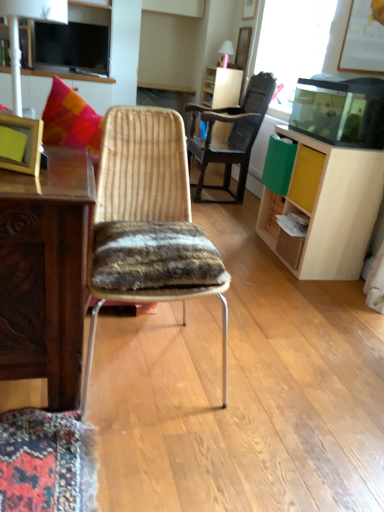
What is the approximate height of matte white lamp at upper left?

matte white lamp at upper left is 18.06 inches tall.

What do you see at coordinates (143, 166) in the screenshot? The image size is (384, 512). I see `woven wood chair at center, which is counted as the first chair, starting from the bottom` at bounding box center [143, 166].

I want to click on woven wood chair at center, arranged as the first chair when viewed from the top, so click(x=230, y=136).

Where is `light wood cabinet at right`? This screenshot has height=512, width=384. light wood cabinet at right is located at coordinates (333, 205).

Where is `matte white lamp at upper left`? The image size is (384, 512). matte white lamp at upper left is located at coordinates tap(18, 32).

Who is smaller, light wood cabinet at right or matte white lamp at upper left?

Smaller between the two is matte white lamp at upper left.

Is light wood cabinet at right positioned far away from matte white lamp at upper left?

That's right, there is a large distance between light wood cabinet at right and matte white lamp at upper left.

Identify the location of cabinetry that is below the matte white lamp at upper left (from the image's perspective). (333, 205).

Is matte white lamp at upper left surrounded by wooden picture frame at left?

No.

From a real-world perspective, which object rests below the other?

wooden picture frame at left is physically lower.

Is wooden picture frame at left positioned in front of matte white lamp at upper left?

No, wooden picture frame at left is further to the viewer.

Between wooden picture frame at left and matte white lamp at upper left, which one has larger width?

With larger width is matte white lamp at upper left.

Which is more to the left, matte white lamp at upper left or woven wood chair at center, positioned as the 2th chair in bottom-to-top order?

matte white lamp at upper left.

Is matte white lamp at upper left not inside woven wood chair at center, placed as the 2th chair when sorted from front to back?

Indeed, matte white lamp at upper left is completely outside woven wood chair at center, placed as the 2th chair when sorted from front to back.

In terms of width, does matte white lamp at upper left look wider or thinner when compared to woven wood chair at center, placed as the 2th chair when sorted from front to back?

Clearly, matte white lamp at upper left has less width compared to woven wood chair at center, placed as the 2th chair when sorted from front to back.

Find the location of a particular element. chair above the matte white lamp at upper left (from the image's perspective) is located at coordinates (230, 136).

Does woven wood chair at center, arranged as the first chair when viewed from the top, have a lesser width compared to woven wood chair at center, acting as the 1th chair starting from the front?

No, woven wood chair at center, arranged as the first chair when viewed from the top, is not thinner than woven wood chair at center, acting as the 1th chair starting from the front.

Is woven wood chair at center, arranged as the first chair when viewed from the top, in front of or behind woven wood chair at center, which is the second chair in back-to-front order, in the image?

In the image, woven wood chair at center, arranged as the first chair when viewed from the top, appears behind woven wood chair at center, which is the second chair in back-to-front order.

Is woven wood chair at center, acting as the 1th chair starting from the front, at the back of woven wood chair at center, which is counted as the 1th chair, starting from the back?

No, woven wood chair at center, which is counted as the 1th chair, starting from the back, is not facing away from woven wood chair at center, acting as the 1th chair starting from the front.

Considering the relative positions of woven wood chair at center, arranged as the first chair when viewed from the top, and woven wood chair at center, acting as the 1th chair starting from the front, in the image provided, is woven wood chair at center, arranged as the first chair when viewed from the top, to the right of woven wood chair at center, acting as the 1th chair starting from the front, from the viewer's perspective?

Indeed, woven wood chair at center, arranged as the first chair when viewed from the top, is positioned on the right side of woven wood chair at center, acting as the 1th chair starting from the front.

In the scene shown: Is light wood drawer at right to the right of wooden picture frame at left from the viewer's perspective?

Indeed, light wood drawer at right is positioned on the right side of wooden picture frame at left.

Consider the image. Is light wood drawer at right located outside wooden picture frame at left?

That's correct, light wood drawer at right is outside of wooden picture frame at left.

From the image's perspective, which is above, light wood drawer at right or wooden picture frame at left?

light wood drawer at right appears higher in the image.

Is light wood drawer at right turned away from wooden picture frame at left?

No, light wood drawer at right is not facing the opposite direction of wooden picture frame at left.

Consider the image. Which of these two, woven wood chair at center, which is the second chair in back-to-front order, or light wood cabinet at right, is thinner?

light wood cabinet at right.

You are a GUI agent. You are given a task and a screenshot of the screen. Output one action in this format:
    pyautogui.click(x=<x>, y=<y>)
    Task: Click on the cabinetry behind the woven wood chair at center, which appears as the second chair when viewed from the top
    The height and width of the screenshot is (512, 384).
    Given the screenshot: What is the action you would take?
    pyautogui.click(x=333, y=205)

Do you think woven wood chair at center, acting as the 1th chair starting from the front, is within light wood cabinet at right, or outside of it?

woven wood chair at center, acting as the 1th chair starting from the front, is outside light wood cabinet at right.

Is woven wood chair at center, which appears as the second chair when viewed from the top, far away from light wood cabinet at right?

Absolutely, woven wood chair at center, which appears as the second chair when viewed from the top, is distant from light wood cabinet at right.

Is the depth of matte white lamp at upper left greater than that of wooden picture frame at left?

No, matte white lamp at upper left is closer to the camera.

This screenshot has width=384, height=512. Identify the location of lamp above the wooden picture frame at left (from a real-world perspective). (18, 32).

Is matte white lamp at upper left wider or thinner than wooden picture frame at left?

matte white lamp at upper left is wider than wooden picture frame at left.

How far apart are matte white lamp at upper left and wooden picture frame at left?

matte white lamp at upper left and wooden picture frame at left are 3.22 meters apart.

The width and height of the screenshot is (384, 512). What are the coordinates of `lamp above the light wood cabinet at right (from a real-world perspective)` in the screenshot? It's located at (18, 32).

The height and width of the screenshot is (512, 384). Find the location of `lamp that is above the wooden picture frame at left (from the image's perspective)`. lamp that is above the wooden picture frame at left (from the image's perspective) is located at coordinates (18, 32).

When comparing their distances from woven wood chair at center, positioned as the 2th chair in bottom-to-top order, does matte white lamp at upper left or light wood cabinet at right seem further?

matte white lamp at upper left is further to woven wood chair at center, positioned as the 2th chair in bottom-to-top order.

Looking at this image, estimate the real-world distances between objects in this image. Which object is closer to light wood drawer at right, light wood cabinet at right or matte white lamp at upper left?

light wood cabinet at right is positioned closer to the anchor light wood drawer at right.

When comparing their distances from woven wood chair at center, arranged as the first chair when viewed from the top, does wooden picture frame at left or matte white lamp at upper left seem further?

Among the two, wooden picture frame at left is located further to woven wood chair at center, arranged as the first chair when viewed from the top.

Looking at this image, based on their spatial positions, is woven wood chair at center, which is the second chair in back-to-front order, or wooden picture frame at left closer to light wood drawer at right?

Among the two, woven wood chair at center, which is the second chair in back-to-front order, is located nearer to light wood drawer at right.

Considering their positions, is woven wood chair at center, acting as the 1th chair starting from the front, positioned further to woven wood chair at center, which is counted as the 1th chair, starting from the back, than matte white lamp at upper left?

woven wood chair at center, acting as the 1th chair starting from the front, is positioned further to the anchor woven wood chair at center, which is counted as the 1th chair, starting from the back.

From the picture: Which object lies nearer to the anchor point light wood cabinet at right, matte white lamp at upper left or woven wood chair at center, positioned as the 2th chair in bottom-to-top order?

woven wood chair at center, positioned as the 2th chair in bottom-to-top order.

Looking at this image, based on their spatial positions, is wooden picture frame at left or matte white lamp at upper left closer to light wood cabinet at right?

wooden picture frame at left lies closer to light wood cabinet at right than the other object.

When comparing their distances from woven wood chair at center, which is the second chair in back-to-front order, does woven wood chair at center, which is counted as the 1th chair, starting from the back, or wooden picture frame at left seem closer?

Among the two, wooden picture frame at left is located nearer to woven wood chair at center, which is the second chair in back-to-front order.

The height and width of the screenshot is (512, 384). Identify the location of drawer between matte white lamp at upper left and woven wood chair at center, arranged as the first chair when viewed from the top, in the front-back direction. (306, 177).

The width and height of the screenshot is (384, 512). I want to click on cabinetry between wooden picture frame at left and woven wood chair at center, placed as the 2th chair when sorted from front to back, along the z-axis, so click(333, 205).

Find the location of a particular element. drawer between matte white lamp at upper left and light wood cabinet at right in the horizontal direction is located at coordinates (306, 177).

Where is `picture frame between woven wood chair at center, acting as the 1th chair starting from the front, and woven wood chair at center, which is counted as the 1th chair, starting from the back, along the z-axis`? picture frame between woven wood chair at center, acting as the 1th chair starting from the front, and woven wood chair at center, which is counted as the 1th chair, starting from the back, along the z-axis is located at coordinates (25, 144).